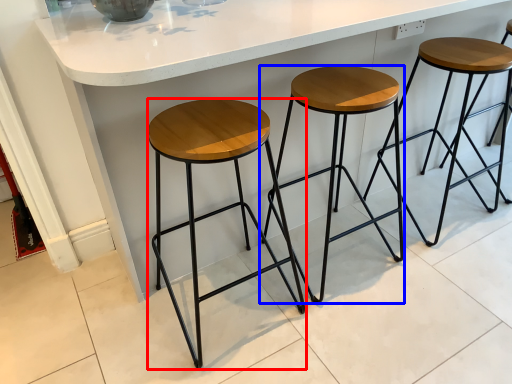
Question: Which object is closer to the camera taking this photo, stool (highlighted by a red box) or stool (highlighted by a blue box)?

Choices:
 (A) stool
 (B) stool

Answer: (A)